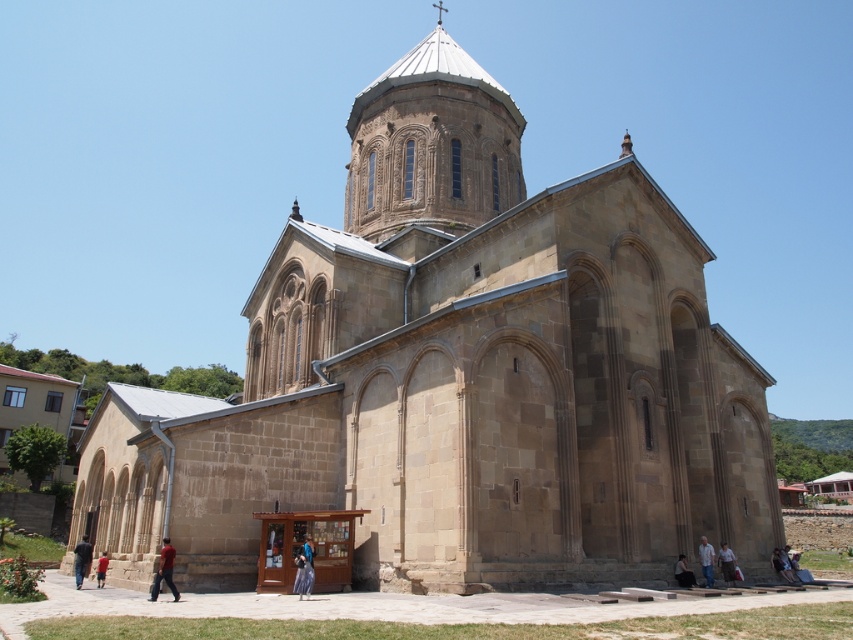
Question: Is light brown stone spire at upper center positioned before light brown leather jacket at lower right?

Choices:
 (A) yes
 (B) no

Answer: (B)

Question: In this image, where is red fabric pants at lower left located relative to dark blue jeans at lower right?

Choices:
 (A) right
 (B) left

Answer: (B)

Question: Which object appears closest to the camera in this image?

Choices:
 (A) blue denim jeans at lower center
 (B) red fabric pants at lower left
 (C) dark brown leather jacket at lower left
 (D) red cotton shirt at lower left

Answer: (B)

Question: Is blue denim jeans at lower center to the right of red cotton shirt at lower left from the viewer's perspective?

Choices:
 (A) no
 (B) yes

Answer: (B)

Question: Which point is closer to the camera?

Choices:
 (A) (798, 580)
 (B) (299, 586)
 (C) (468, 196)

Answer: (B)

Question: Estimate the real-world distances between objects in this image. Which object is closer to the red cotton shirt at lower left?

Choices:
 (A) light blue fabric shirt at lower right
 (B) blue denim jeans at lower center
 (C) dark gray stone person at lower center

Answer: (B)